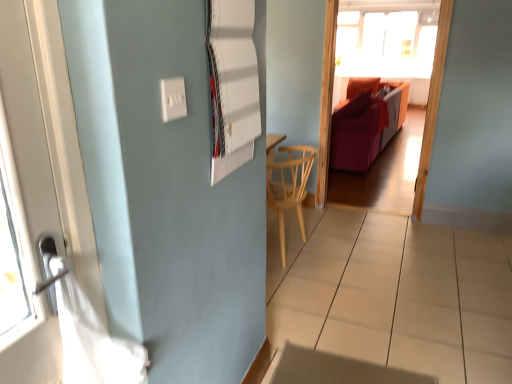
Locate an element on the screen. space that is in front of light wood chair at center is located at coordinates (317, 289).